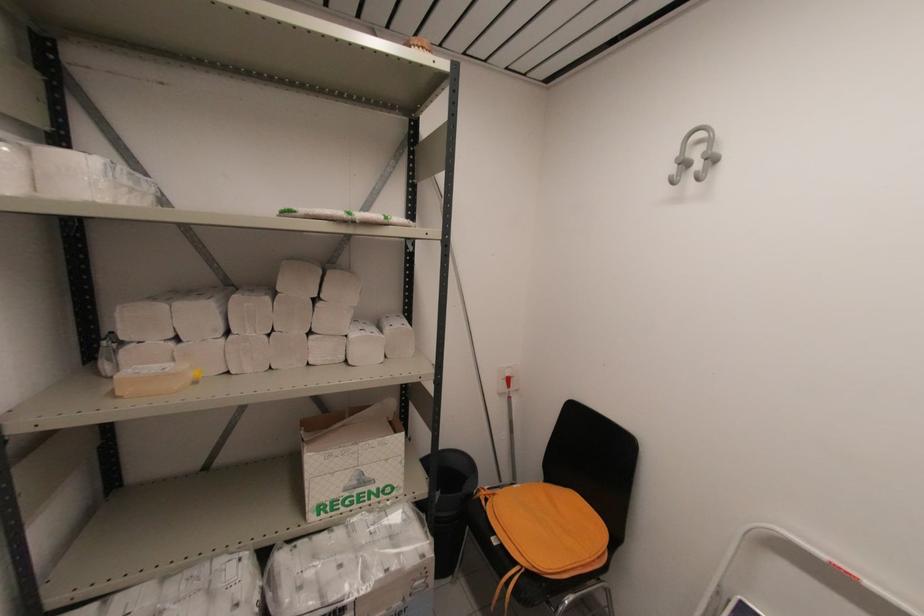
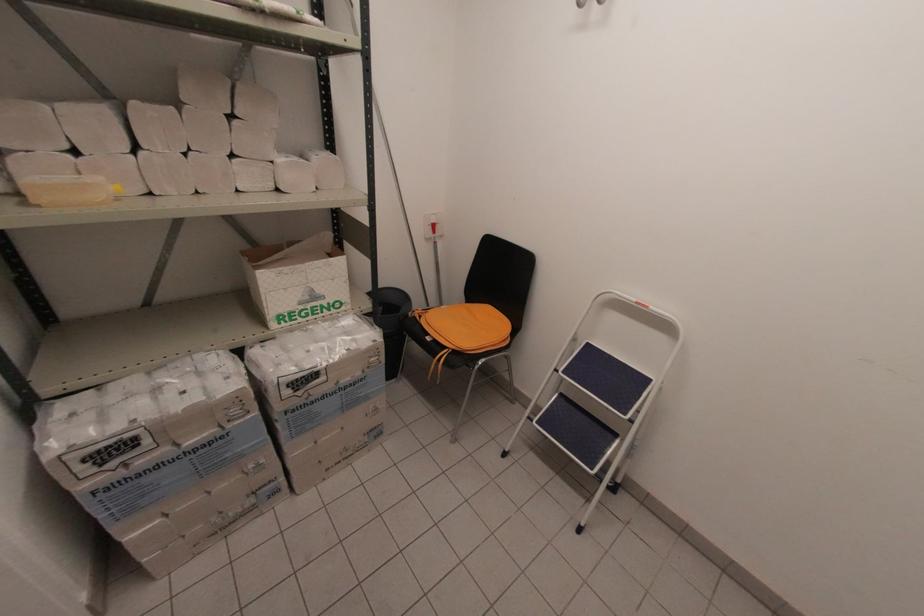
In the second image, find the point that corresponds to (x=196, y=374) in the first image.

(116, 188)